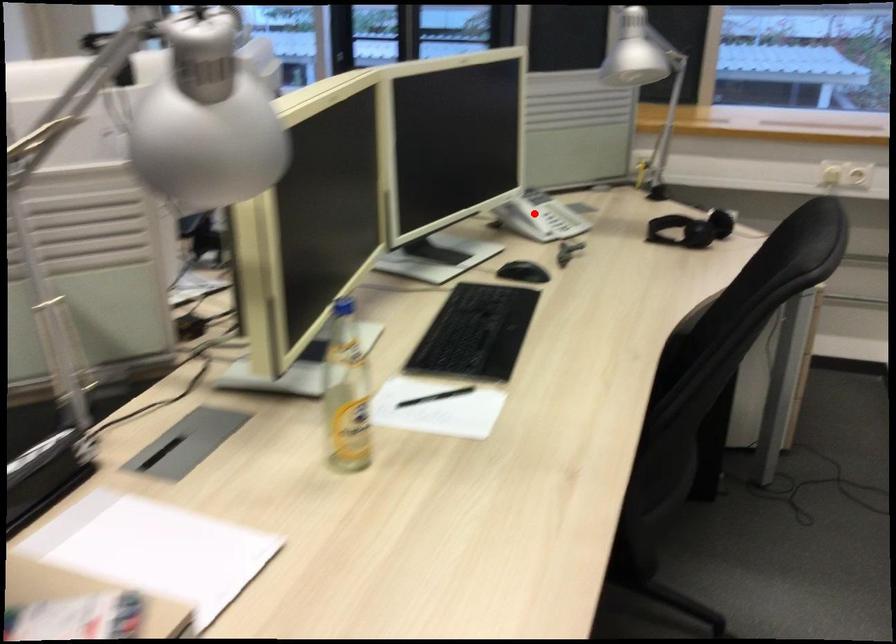
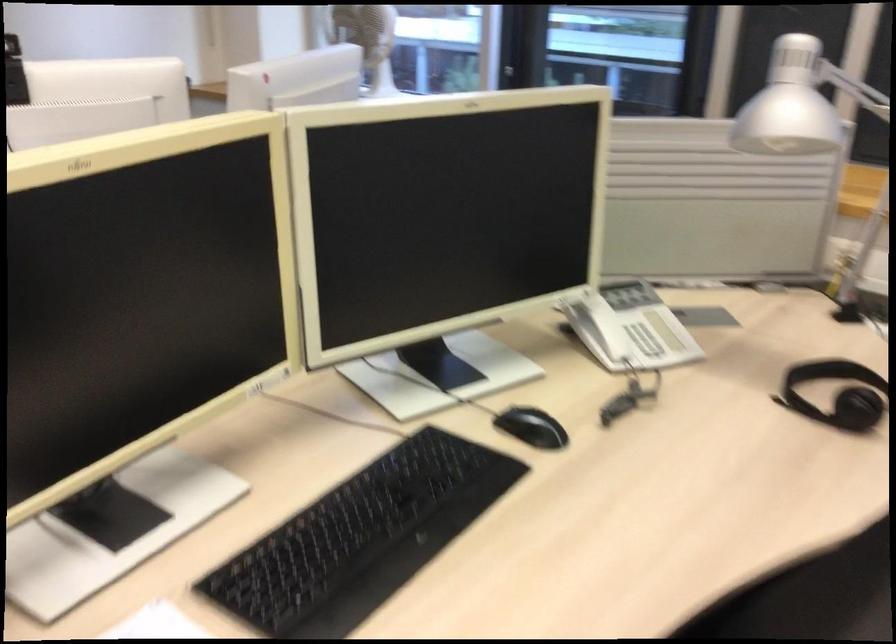
Question: I am providing you with two images of the same scene from different viewpoints. A red point is shown in image1. For the corresponding object point in image2, is it positioned nearer or farther from the camera?

Choices:
 (A) Nearer
 (B) Farther

Answer: (A)